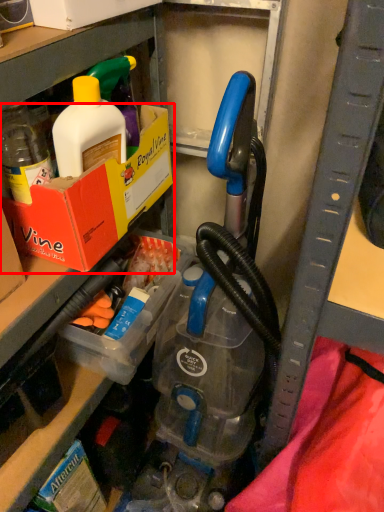
Question: Where is box (annotated by the red box) located in relation to storage box in the image?

Choices:
 (A) left
 (B) right

Answer: (A)